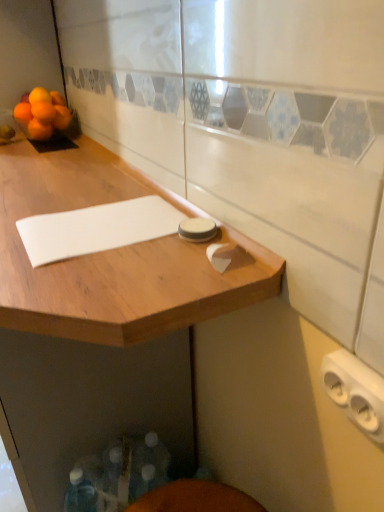
I want to click on free space below white matte notepad at center (from a real-world perspective), so click(x=100, y=225).